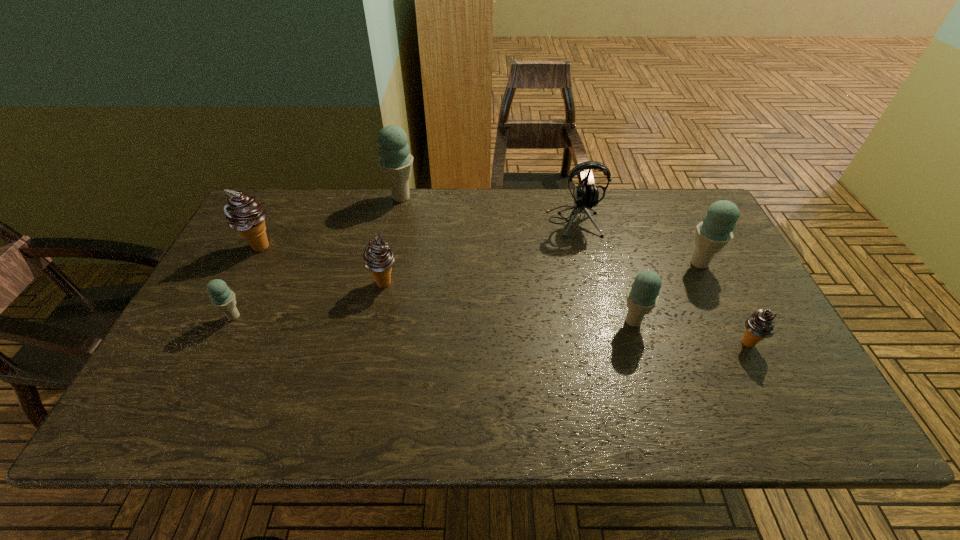
Select which object appears as the closest to the earphone. Please provide its 2D coordinates. Your answer should be formatted as a tuple, i.e. [(x, y)], where the tuple contains the x and y coordinates of a point satisfying the conditions above.

[(715, 231)]

You are a GUI agent. You are given a task and a screenshot of the screen. Output one action in this format:
    pyautogui.click(x=<x>, y=<y>)
    Task: Click on the ice cream that stands as the sixth closest to the rightmost blue ice cream
    
    Given the screenshot: What is the action you would take?
    pyautogui.click(x=221, y=296)

The width and height of the screenshot is (960, 540). I want to click on the fourth closest ice cream relative to the second smallest chocolate icecream, so click(x=642, y=296).

Choose which blue ice cream is the third nearest neighbor to the second blue ice cream from left to right. Please provide its 2D coordinates. Your answer should be formatted as a tuple, i.e. [(x, y)], where the tuple contains the x and y coordinates of a point satisfying the conditions above.

[(715, 231)]

Find the location of a particular element. The image size is (960, 540). blue ice cream object that ranks as the second closest to the second chocolate icecream from left to right is located at coordinates (221, 296).

Locate an element on the screen. the closest chocolate icecream to the rightmost chocolate icecream is located at coordinates (378, 257).

Point out which chocolate icecream is positioned as the second nearest to the farthest ice cream. Please provide its 2D coordinates. Your answer should be formatted as a tuple, i.e. [(x, y)], where the tuple contains the x and y coordinates of a point satisfying the conditions above.

[(243, 213)]

Find the location of `free space in the image that satisfies the following two spatial constraints: 1. on the front side of the second nearest chocolate icecream; 2. on the left side of the fifth ice cream from left to right`. free space in the image that satisfies the following two spatial constraints: 1. on the front side of the second nearest chocolate icecream; 2. on the left side of the fifth ice cream from left to right is located at coordinates (376, 321).

At what (x,y) coordinates should I click in order to perform the action: click on vacant space that satisfies the following two spatial constraints: 1. on the back side of the farthest blue ice cream; 2. on the left side of the farthest chocolate icecream. Please return your answer as a coordinate pair (x, y). This screenshot has height=540, width=960. Looking at the image, I should click on (285, 198).